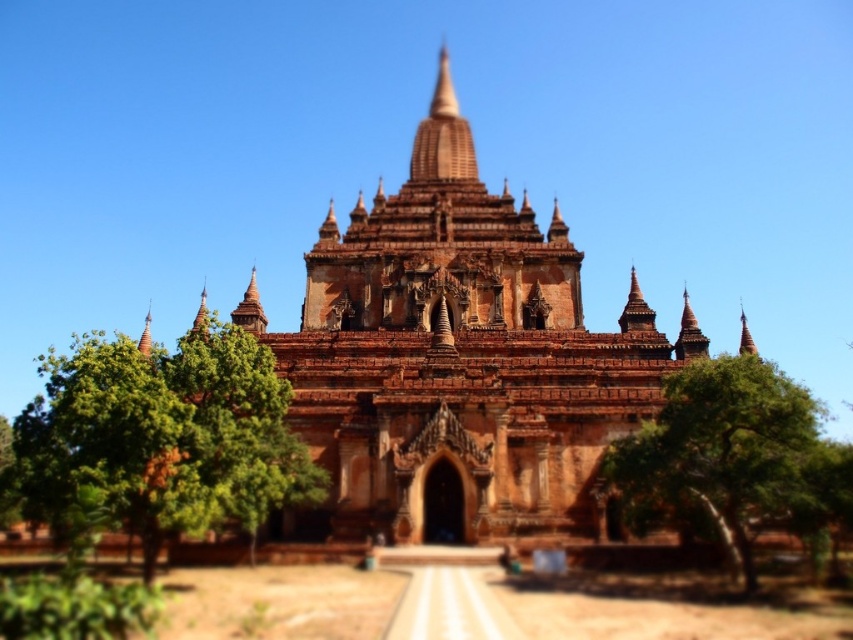
You are a tourist standing in front of the brown stone temple at center and want to take a photo that includes both the green leafy tree at left and the temple. Which object should you position closer to the camera to ensure both are in frame?

The green leafy tree at left is shorter than the brown stone temple at center, so you should position the brown stone temple at center closer to the camera to ensure both are in frame.

You are a tourist standing in front of the temple and want to take a photo that includes both the brown textured pagoda at center and the green leafy tree at lower right. Based on their positions, will the tree appear in front of or behind the pagoda in the photo?

The brown textured pagoda at center is positioned over the green leafy tree at lower right, so in the photo, the tree will appear behind the pagoda.

You are standing in front of the temple and notice a specific point marked at coordinates (x=457, y=362). What significant structure is located at that point?

The point at coordinates (x=457, y=362) marks the location of the brown textured pagoda at center.